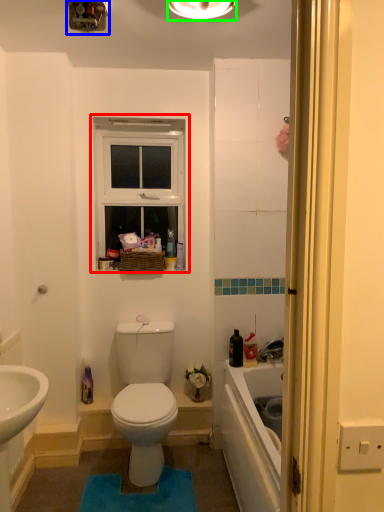
Question: Considering the real-world distances, which object is closest to window (highlighted by a red box)? light fixture (highlighted by a blue box) or light fixture (highlighted by a green box).

Choices:
 (A) light fixture
 (B) light fixture

Answer: (A)